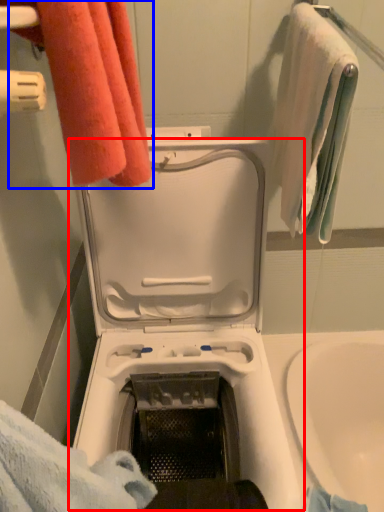
Question: Which point is closer to the camera, washing machine (highlighted by a red box) or towel (highlighted by a blue box)?

Choices:
 (A) washing machine
 (B) towel

Answer: (A)